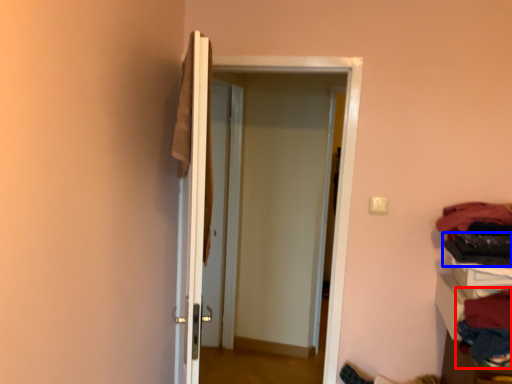
Question: Which object appears closest to the camera in this image, clothing (highlighted by a red box) or clothing (highlighted by a blue box)?

Choices:
 (A) clothing
 (B) clothing

Answer: (A)